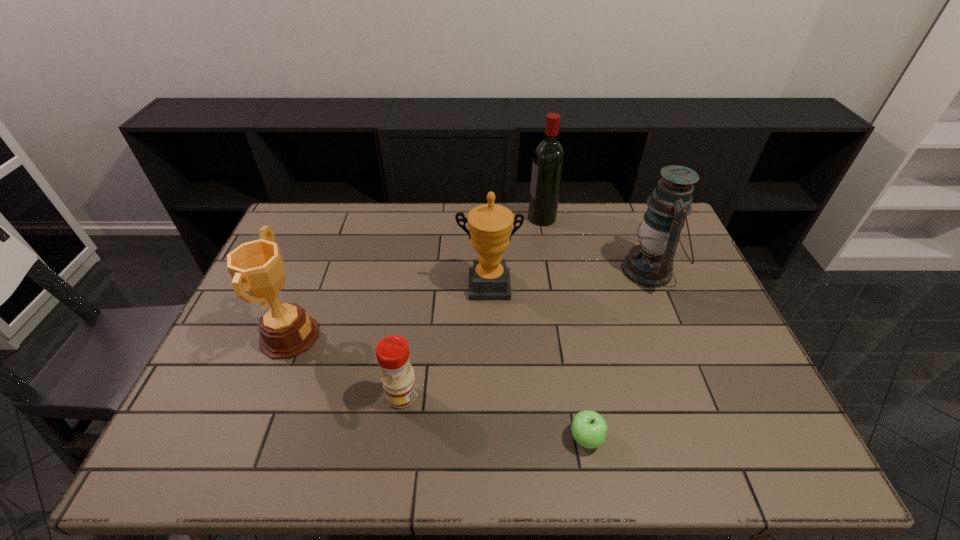
Find the location of a particular element. object that is at the left edge is located at coordinates (286, 330).

Where is `object present at the right edge`? object present at the right edge is located at coordinates pyautogui.click(x=650, y=264).

In the image, there is a desktop. Identify the location of vacant space at the far edge. The image size is (960, 540). (371, 235).

In the image, there is a desktop. At what (x,y) coordinates should I click in order to perform the action: click on free space at the left edge. Please return your answer as a coordinate pair (x, y). This screenshot has height=540, width=960. Looking at the image, I should click on (220, 393).

Where is `free space at the right edge of the desktop`? free space at the right edge of the desktop is located at coordinates (697, 288).

This screenshot has width=960, height=540. Identify the location of free location at the near left corner of the desktop. (224, 468).

Where is `free point between the nearer award and the right award`? This screenshot has height=540, width=960. free point between the nearer award and the right award is located at coordinates point(389,311).

Find the location of a particular element. The height and width of the screenshot is (540, 960). vacant point located between the third object from left to right and the second shortest object is located at coordinates (445, 340).

I want to click on vacant area between the rightmost object and the fourth object from right to left, so click(569, 278).

Locate an element on the screen. Image resolution: width=960 pixels, height=540 pixels. free space between the wine bottle and the rightmost object is located at coordinates 595,244.